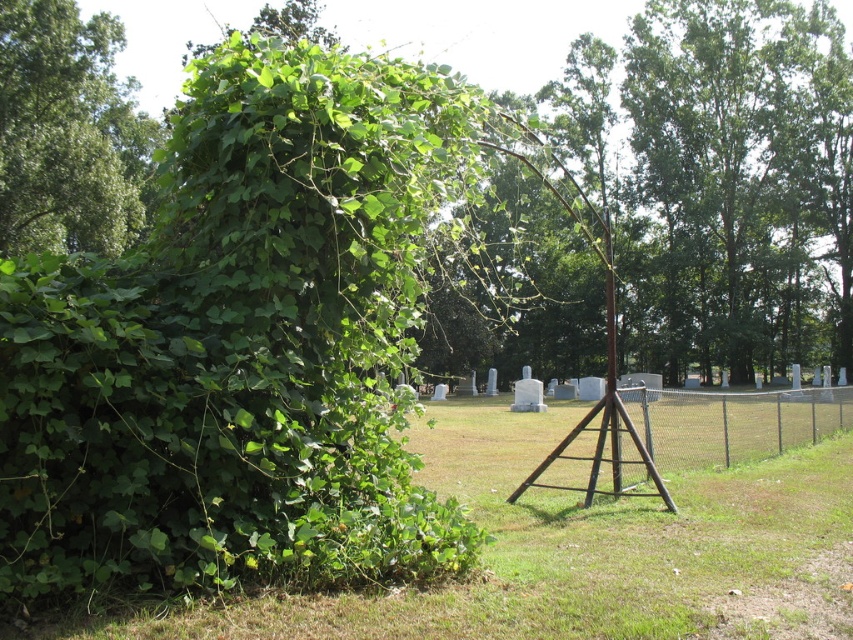
Is green grass at center below chain link fence at right?

Yes, green grass at center is below chain link fence at right.

Image resolution: width=853 pixels, height=640 pixels. In order to click on green grass at center in this screenshot , I will do `click(585, 548)`.

Between point (131, 624) and point (631, 472), which one is positioned in front?

Point (131, 624)

Locate an element on the screen. green grass at center is located at coordinates (585, 548).

Describe the element at coordinates (746, 172) in the screenshot. This screenshot has height=640, width=853. I see `green leafy tree at upper right` at that location.

Is point (643, 99) closer to viewer compared to point (689, 410)?

No, (643, 99) is behind (689, 410).

Between point (747, 336) and point (808, 444), which one is positioned in front?

Point (808, 444) is more forward.

I want to click on green leafy tree at upper right, so coord(746,172).

Is green leafy tree at upper right smaller than green leafy tree at left?

No, green leafy tree at upper right is not smaller than green leafy tree at left.

Does green leafy tree at upper right appear under green leafy tree at left?

Incorrect, green leafy tree at upper right is not positioned below green leafy tree at left.

Who is more distant from viewer, [756,310] or [74,4]?

Point [756,310]

The image size is (853, 640). In order to click on green leafy tree at upper right in this screenshot , I will do `click(746, 172)`.